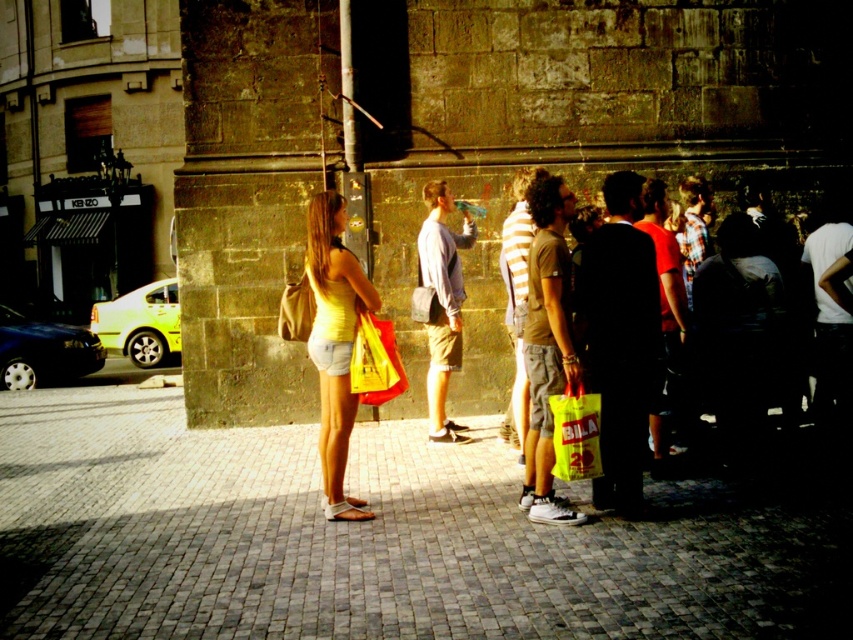
Question: Can you confirm if yellow plastic bag at center-right is bigger than yellow plastic bag at center?

Choices:
 (A) no
 (B) yes

Answer: (B)

Question: Which object is positioned closest to the yellow matte tank top at center?

Choices:
 (A) yellow plastic bag at center
 (B) light blue cotton shirt at center
 (C) metallic pole at center

Answer: (A)

Question: Which object is positioned closest to the yellow matte tank top at center?

Choices:
 (A) light blue cotton shirt at center
 (B) gray brick pavement at center
 (C) yellow plastic bag at center-right

Answer: (B)

Question: Does yellow plastic bag at center-right appear on the left side of yellow matte tank top at center?

Choices:
 (A) no
 (B) yes

Answer: (A)

Question: Which object is farther from the camera taking this photo?

Choices:
 (A) yellow plastic bag at center-right
 (B) metallic pole at center
 (C) yellow plastic bag at center

Answer: (B)

Question: Is yellow matte tank top at center in front of light blue cotton shirt at center?

Choices:
 (A) no
 (B) yes

Answer: (B)